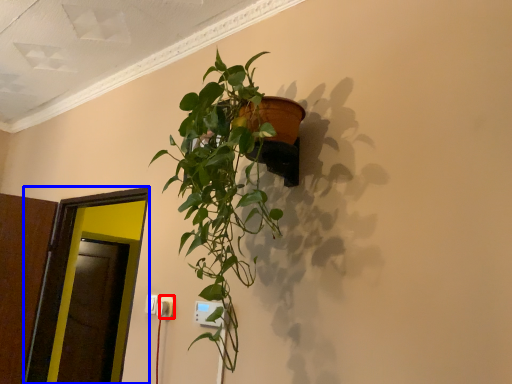
Question: Among these objects, which one is nearest to the camera, electric outlet (highlighted by a red box) or glass door (highlighted by a blue box)?

Choices:
 (A) electric outlet
 (B) glass door

Answer: (A)